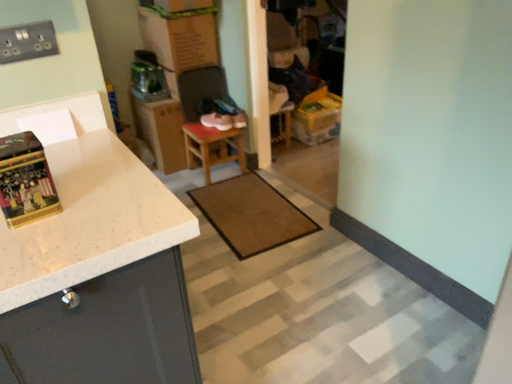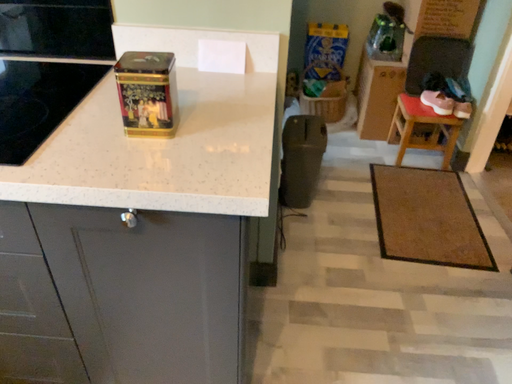
Question: Which way did the camera rotate in the video?

Choices:
 (A) rotated right
 (B) rotated left

Answer: (B)